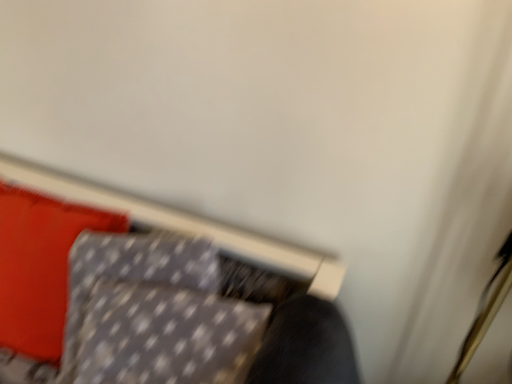
Question: From the image's perspective, is gray dotted fabric cushion at lower left on top of gray dotted pillow at upper left?

Choices:
 (A) yes
 (B) no

Answer: (B)

Question: Is gray dotted fabric cushion at lower left behind gray dotted pillow at upper left?

Choices:
 (A) no
 (B) yes

Answer: (A)

Question: Is gray dotted fabric cushion at lower left placed right next to gray dotted pillow at upper left?

Choices:
 (A) no
 (B) yes

Answer: (B)

Question: From a real-world perspective, is gray dotted fabric cushion at lower left physically below gray dotted pillow at upper left?

Choices:
 (A) no
 (B) yes

Answer: (A)

Question: Considering the relative sizes of gray dotted fabric cushion at lower left and gray dotted pillow at upper left in the image provided, is gray dotted fabric cushion at lower left shorter than gray dotted pillow at upper left?

Choices:
 (A) yes
 (B) no

Answer: (A)

Question: Is gray dotted fabric cushion at lower left smaller than gray dotted pillow at upper left?

Choices:
 (A) no
 (B) yes

Answer: (A)

Question: Can you confirm if gray dotted pillow at upper left is positioned to the left of gray dotted fabric cushion at lower left?

Choices:
 (A) no
 (B) yes

Answer: (B)

Question: Can you confirm if gray dotted pillow at upper left is smaller than gray dotted fabric cushion at lower left?

Choices:
 (A) yes
 (B) no

Answer: (A)

Question: Does gray dotted pillow at upper left have a greater height compared to gray dotted fabric cushion at lower left?

Choices:
 (A) no
 (B) yes

Answer: (B)

Question: Is gray dotted pillow at upper left far from gray dotted fabric cushion at lower left?

Choices:
 (A) yes
 (B) no

Answer: (B)

Question: From a real-world perspective, is gray dotted pillow at upper left beneath gray dotted fabric cushion at lower left?

Choices:
 (A) no
 (B) yes

Answer: (B)

Question: Is gray dotted pillow at upper left positioned with its back to gray dotted fabric cushion at lower left?

Choices:
 (A) yes
 (B) no

Answer: (B)

Question: Based on their positions, is gray dotted pillow at upper left located to the left or right of gray dotted fabric cushion at lower left?

Choices:
 (A) left
 (B) right

Answer: (A)